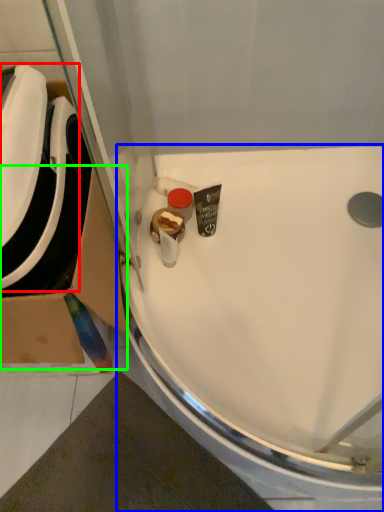
Question: Considering the real-world distances, which object is closest to sink (highlighted by a red box)? sink (highlighted by a blue box) or cardboard box (highlighted by a green box).

Choices:
 (A) sink
 (B) cardboard box

Answer: (B)